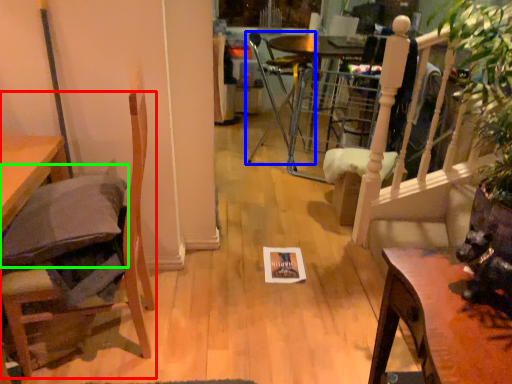
Question: Based on their relative distances, which object is farther from chair (highlighted by a red box)? Choose from chair (highlighted by a blue box) and pillow (highlighted by a green box).

Choices:
 (A) chair
 (B) pillow

Answer: (A)